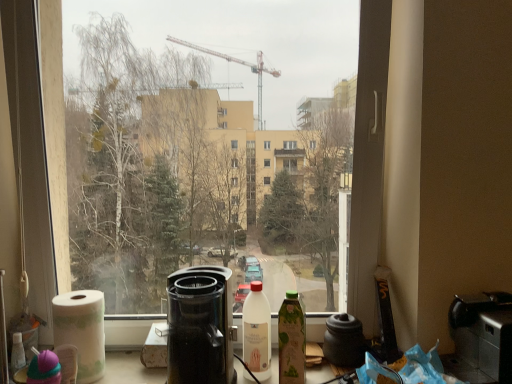
Question: Is transparent glass window at center not near green glass bottle at center, the second bottle in the left-to-right sequence?

Choices:
 (A) no
 (B) yes

Answer: (B)

Question: Considering the relative positions of transparent glass window at center and green glass bottle at center, which is the 1th bottle in right-to-left order, in the image provided, is transparent glass window at center to the left of green glass bottle at center, which is the 1th bottle in right-to-left order, from the viewer's perspective?

Choices:
 (A) no
 (B) yes

Answer: (B)

Question: From the image's perspective, is transparent glass window at center under green glass bottle at center, the second bottle in the left-to-right sequence?

Choices:
 (A) no
 (B) yes

Answer: (A)

Question: Is transparent glass window at center positioned in front of green glass bottle at center, which is the 1th bottle in right-to-left order?

Choices:
 (A) no
 (B) yes

Answer: (B)

Question: Is transparent glass window at center surrounding green glass bottle at center, which is the 1th bottle in right-to-left order?

Choices:
 (A) yes
 (B) no

Answer: (B)

Question: Considering the positions of point (508, 294) and point (294, 77), is point (508, 294) closer or farther from the camera than point (294, 77)?

Choices:
 (A) closer
 (B) farther

Answer: (A)

Question: Considering the positions of black plastic toaster at lower right, which appears as the second appliance when viewed from the left, and transparent glass window at center in the image, is black plastic toaster at lower right, which appears as the second appliance when viewed from the left, taller or shorter than transparent glass window at center?

Choices:
 (A) short
 (B) tall

Answer: (A)

Question: In terms of width, does black plastic toaster at lower right, which appears as the second appliance when viewed from the left, look wider or thinner when compared to transparent glass window at center?

Choices:
 (A) wide
 (B) thin

Answer: (B)

Question: Is black plastic toaster at lower right, which appears as the second appliance when viewed from the left, situated inside transparent glass window at center or outside?

Choices:
 (A) inside
 (B) outside

Answer: (B)

Question: Based on their positions, is white matte bottle at center, which is the 2th bottle from right to left, located to the left or right of black plastic toaster at lower right, the 1th appliance in the right-to-left sequence?

Choices:
 (A) left
 (B) right

Answer: (A)

Question: Is white matte bottle at center, the 1th bottle viewed from the left, bigger or smaller than black plastic toaster at lower right, the 1th appliance in the right-to-left sequence?

Choices:
 (A) small
 (B) big

Answer: (A)

Question: Is white matte bottle at center, which is the 2th bottle from right to left, situated inside black plastic toaster at lower right, which appears as the second appliance when viewed from the left, or outside?

Choices:
 (A) outside
 (B) inside

Answer: (A)

Question: From a real-world perspective, relative to black plastic toaster at lower right, the 1th appliance in the right-to-left sequence, is white matte bottle at center, the 1th bottle viewed from the left, vertically above or below?

Choices:
 (A) below
 (B) above

Answer: (B)

Question: Relative to matte black coffeepot at center, is transparent glass window at center in front or behind?

Choices:
 (A) behind
 (B) front

Answer: (B)

Question: Is transparent glass window at center taller or shorter than matte black coffeepot at center?

Choices:
 (A) tall
 (B) short

Answer: (A)